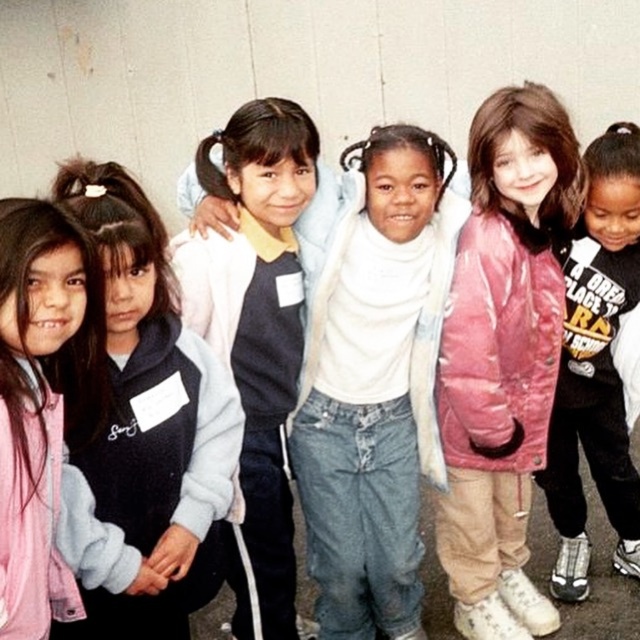
Does pink fleece jacket at left have a smaller size compared to pink fleece jacket at center?

Correct, pink fleece jacket at left occupies less space than pink fleece jacket at center.

Who is shorter, pink fleece jacket at left or pink fleece jacket at center?

pink fleece jacket at left is shorter.

Does point (29, 522) come behind point (600, 218)?

No, it is not.

Where is `pink fleece jacket at left`? The image size is (640, 640). pink fleece jacket at left is located at coordinates (42, 401).

I want to click on pink shiny jacket at center, so click(502, 356).

Is pink shiny jacket at center taller than pink fleece jacket at center?

Correct, pink shiny jacket at center is much taller as pink fleece jacket at center.

Locate an element on the screen. This screenshot has height=640, width=640. pink shiny jacket at center is located at coordinates (502, 356).

Where is `pink shiny jacket at center`? The height and width of the screenshot is (640, 640). pink shiny jacket at center is located at coordinates (502, 356).

Between pink shiny jacket at center and pink fleece jacket at left, which one has less height?

pink fleece jacket at left

Between point (480, 429) and point (13, 208), which one is positioned behind?

Positioned behind is point (480, 429).

Find the location of a particular element. The width and height of the screenshot is (640, 640). pink shiny jacket at center is located at coordinates (502, 356).